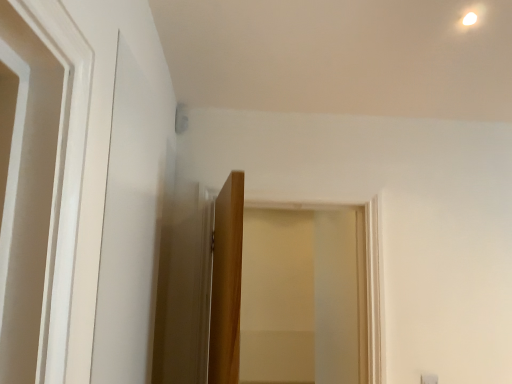
Find the location of a particular element. This screenshot has width=512, height=384. satin glass door at center is located at coordinates (288, 293).

What do you see at coordinates (288, 293) in the screenshot? The height and width of the screenshot is (384, 512). I see `satin glass door at center` at bounding box center [288, 293].

What are the coordinates of `satin glass door at center` in the screenshot? It's located at (288, 293).